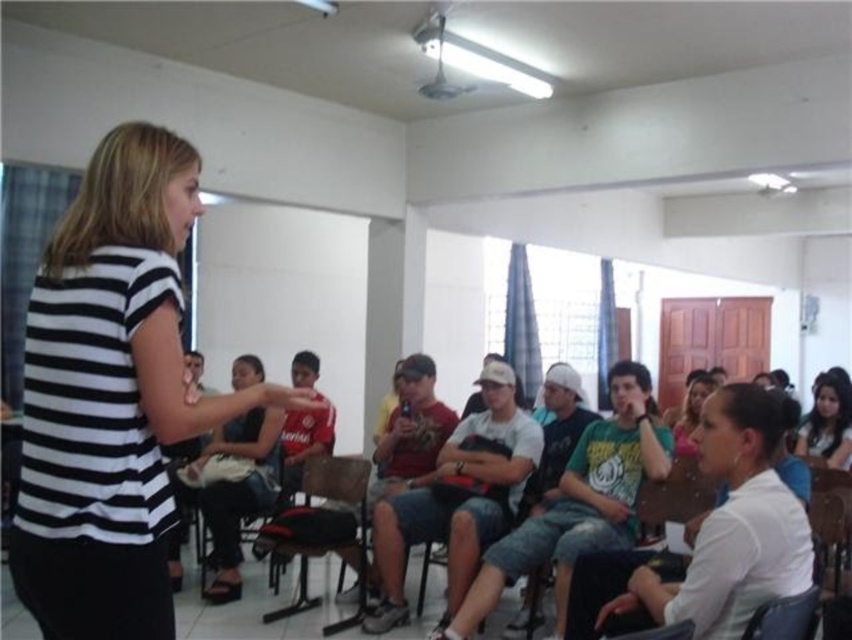
The image size is (852, 640). What do you see at coordinates (112, 396) in the screenshot? I see `black striped shirt at center` at bounding box center [112, 396].

Who is more forward, (x=22, y=532) or (x=357, y=540)?

Positioned in front is point (x=22, y=532).

Where is `black striped shirt at center`? black striped shirt at center is located at coordinates (112, 396).

Can you confirm if black striped shirt at center is positioned above matte black hair at lower right?

Indeed, black striped shirt at center is positioned over matte black hair at lower right.

Which is behind, point (124, 564) or point (822, 442)?

The point (822, 442) is more distant.

Does point (133, 556) lie behind point (799, 438)?

No, (133, 556) is in front of (799, 438).

This screenshot has height=640, width=852. What are the coordinates of `black striped shirt at center` in the screenshot? It's located at (112, 396).

Is the position of white matte shirt at lower right less distant than that of wooden chair at center?

Yes.

Who is more distant from viewer, (752, 579) or (252, 509)?

Point (252, 509)

Between point (684, 600) and point (216, 582), which one is positioned in front?

Point (684, 600) is in front.

Find the location of a particular element. white matte shirt at lower right is located at coordinates (730, 525).